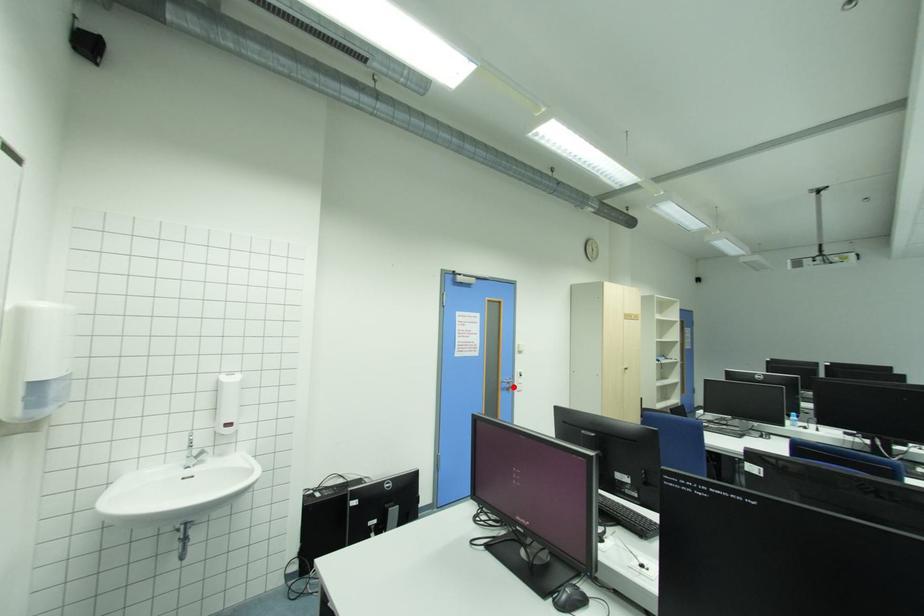
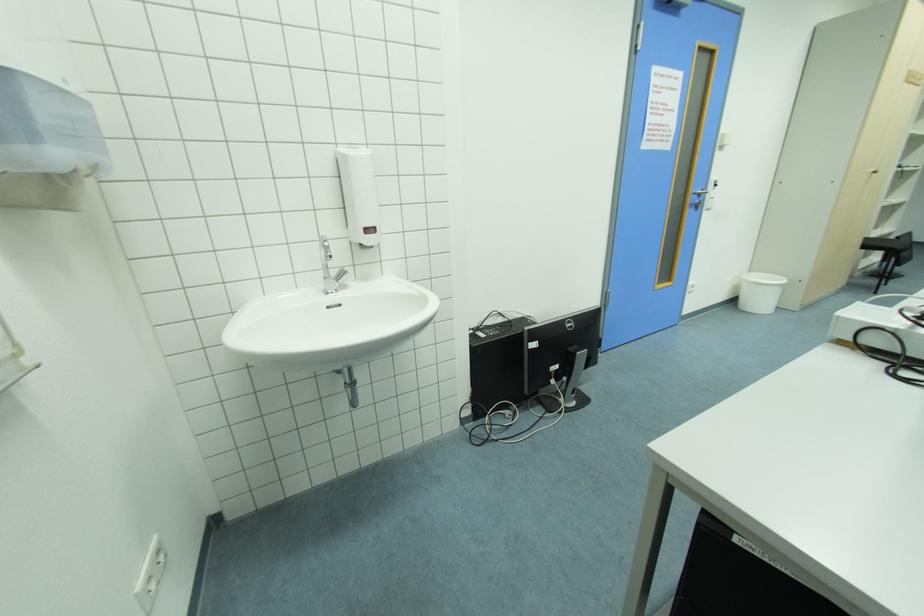
Question: A red point is marked in image1. In image2, is the corresponding 3D point closer to the camera or farther? Reply with the corresponding letter.

Choices:
 (A) The corresponding 3D point is closer.
 (B) The corresponding 3D point is farther.

Answer: (A)